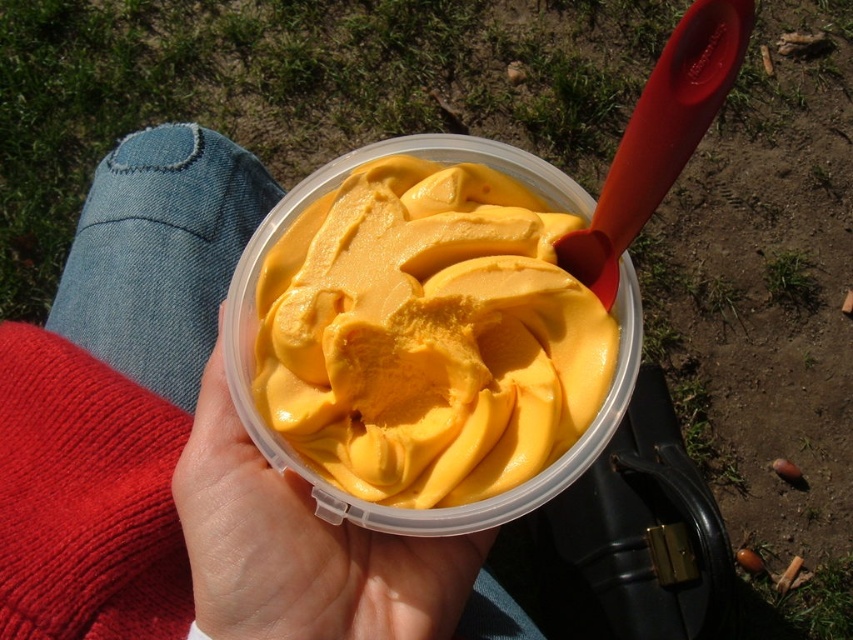
Is yellow creamy ice cream at center thinner than yellow matte ice cream at center?

Incorrect, yellow creamy ice cream at center's width is not less than yellow matte ice cream at center's.

How distant is yellow creamy ice cream at center from yellow matte ice cream at center?

yellow creamy ice cream at center and yellow matte ice cream at center are 3.92 inches apart.

Which is in front, point (299, 396) or point (463, 561)?

Point (299, 396)

Find the location of a particular element. yellow creamy ice cream at center is located at coordinates (428, 336).